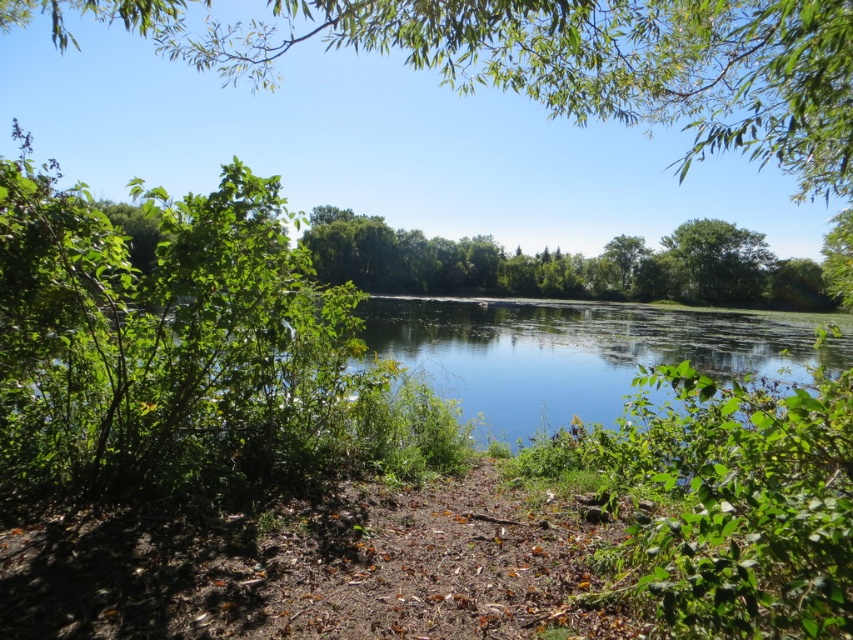
Does green leafy tree at upper right appear over green leafy tree at upper center?

No, green leafy tree at upper right is not above green leafy tree at upper center.

Can you confirm if green leafy tree at upper right is positioned to the right of green leafy tree at upper center?

Yes, green leafy tree at upper right is to the right of green leafy tree at upper center.

Where is `green leafy tree at upper right`? green leafy tree at upper right is located at coordinates (718, 260).

Does clear blue water at center have a larger size compared to green leafy tree at upper right?

Yes, clear blue water at center is bigger than green leafy tree at upper right.

Which is below, clear blue water at center or green leafy tree at upper right?

clear blue water at center

Does point (581, 380) come behind point (672, 246)?

No, it is not.

You are a GUI agent. You are given a task and a screenshot of the screen. Output one action in this format:
    pyautogui.click(x=<x>, y=<y>)
    Task: Click on the clear blue water at center
    
    Given the screenshot: What is the action you would take?
    pyautogui.click(x=581, y=353)

Does clear blue water at center appear under green leafy tree at upper center?

Indeed, clear blue water at center is positioned under green leafy tree at upper center.

Looking at this image, can you confirm if clear blue water at center is positioned above green leafy tree at upper center?

Actually, clear blue water at center is below green leafy tree at upper center.

Identify the location of clear blue water at center. The height and width of the screenshot is (640, 853). [x=581, y=353].

You are a GUI agent. You are given a task and a screenshot of the screen. Output one action in this format:
    pyautogui.click(x=<x>, y=<y>)
    Task: Click on the clear blue water at center
    Image resolution: width=853 pixels, height=640 pixels.
    Given the screenshot: What is the action you would take?
    pyautogui.click(x=581, y=353)